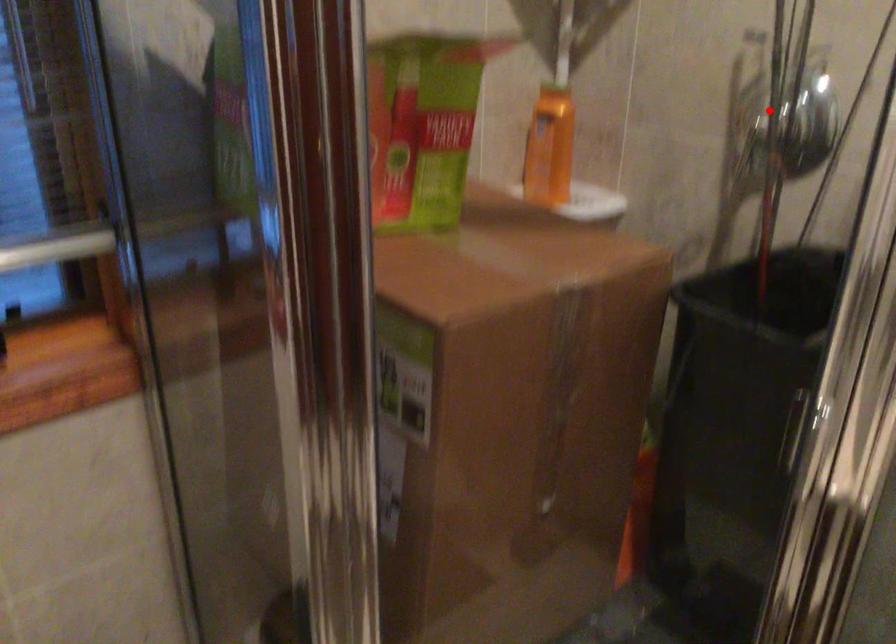
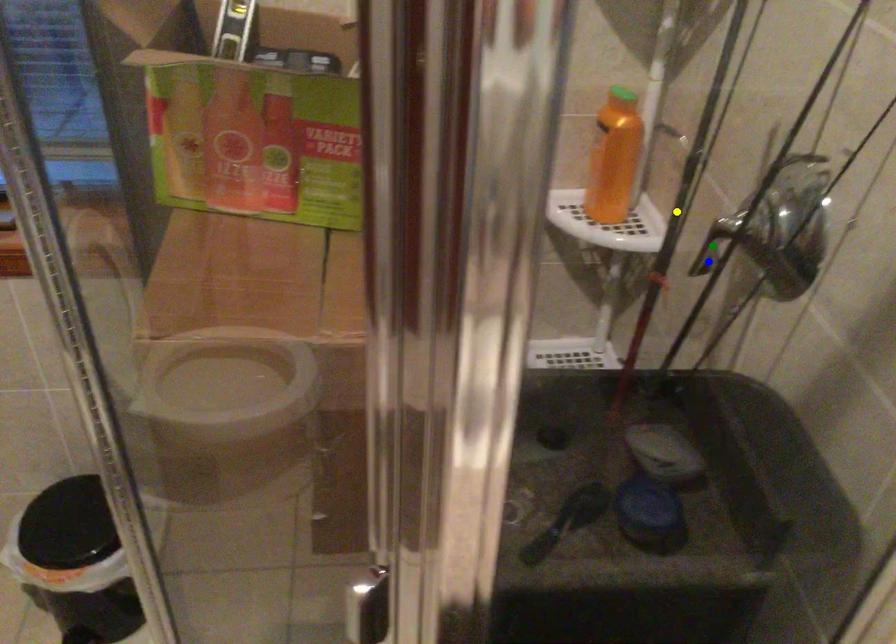
Question: I am providing you with two images of the same scene from different viewpoints. A red point is marked on the first image. You are given multiple points on the second image. Can you choose the point in image 2 that corresponds to the point in image 1?

Choices:
 (A) blue point
 (B) yellow point
 (C) green point

Answer: (B)